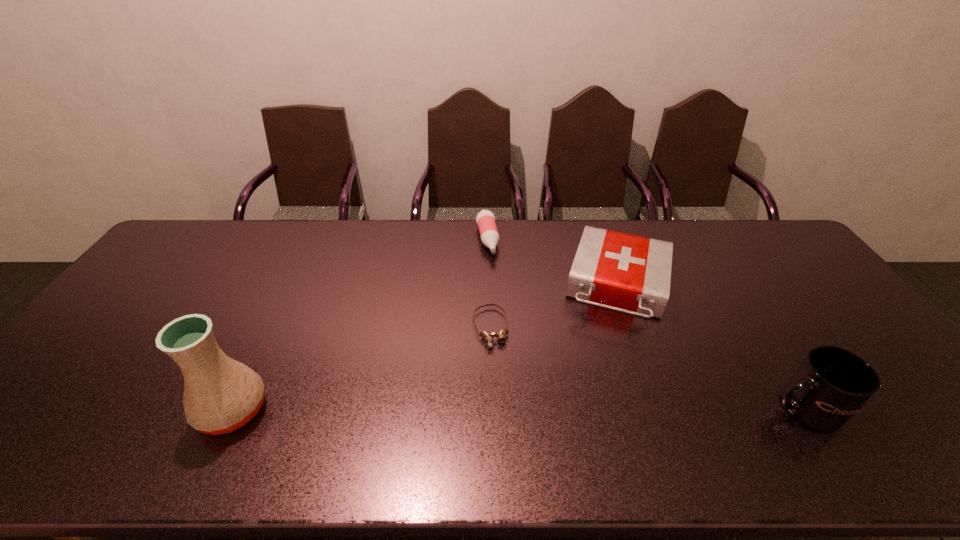
The height and width of the screenshot is (540, 960). In order to click on vacant space on the desktop that is between the pottery and the fourth shortest object and is positioned on the front side of the first-aid kit in this screenshot , I will do `click(595, 408)`.

You are a GUI agent. You are given a task and a screenshot of the screen. Output one action in this format:
    pyautogui.click(x=<x>, y=<y>)
    Task: Click on the free space on the desktop that is between the leftmost object and the fourth shortest object and is positioned with the cap open on the fourth tallest object
    This screenshot has height=540, width=960.
    Given the screenshot: What is the action you would take?
    pyautogui.click(x=527, y=409)

Where is `vacant space on the desktop that is between the pottery and the fourth shortest object and is positioned on the front lenses and sides of the shortest object`? Image resolution: width=960 pixels, height=540 pixels. vacant space on the desktop that is between the pottery and the fourth shortest object and is positioned on the front lenses and sides of the shortest object is located at coordinates (511, 409).